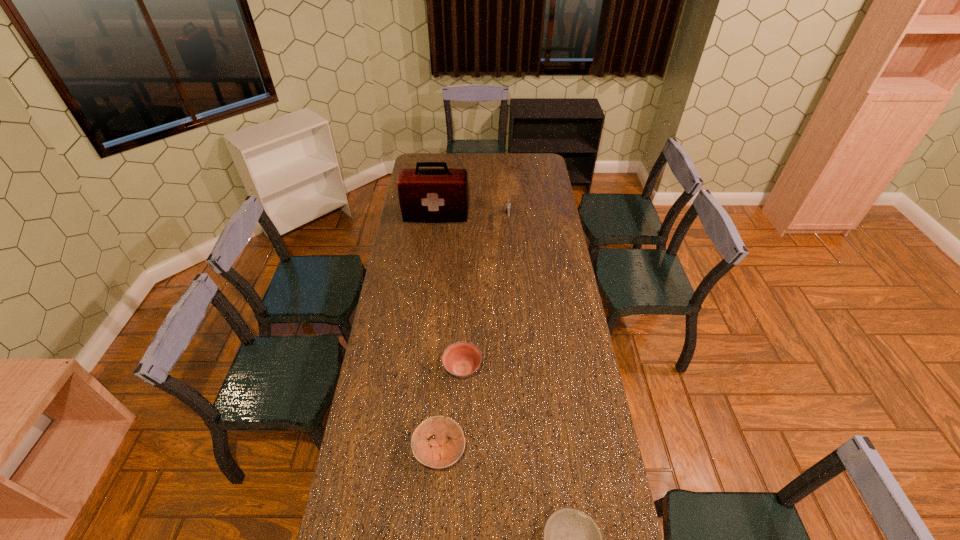
Image resolution: width=960 pixels, height=540 pixels. I want to click on blank area at the far edge, so click(x=521, y=161).

In the image, there is a desktop. Identify the location of vacant space at the left edge. This screenshot has height=540, width=960. (370, 432).

Locate an element on the screen. Image resolution: width=960 pixels, height=540 pixels. free spot at the right edge of the desktop is located at coordinates (533, 176).

In the image, there is a desktop. Where is `vacant space at the far left corner`? vacant space at the far left corner is located at coordinates (422, 158).

What are the coordinates of `empty space that is in between the second tallest object and the second farthest bowl` in the screenshot? It's located at (473, 336).

The height and width of the screenshot is (540, 960). I want to click on unoccupied position between the first aid kit and the second farthest bowl, so click(x=438, y=334).

At what (x,y) coordinates should I click in order to perform the action: click on empty space between the third nearest object and the fourth shortest object. Please return your answer as a coordinate pair (x, y). This screenshot has width=960, height=540. Looking at the image, I should click on (485, 295).

The image size is (960, 540). What are the coordinates of `free area in between the second nearest object and the third farthest object` in the screenshot? It's located at (451, 411).

This screenshot has width=960, height=540. I want to click on unoccupied area between the farthest bowl and the tallest object, so click(x=449, y=294).

Where is `vacant area that lies between the farthest bowl and the gun`? The width and height of the screenshot is (960, 540). vacant area that lies between the farthest bowl and the gun is located at coordinates click(485, 295).